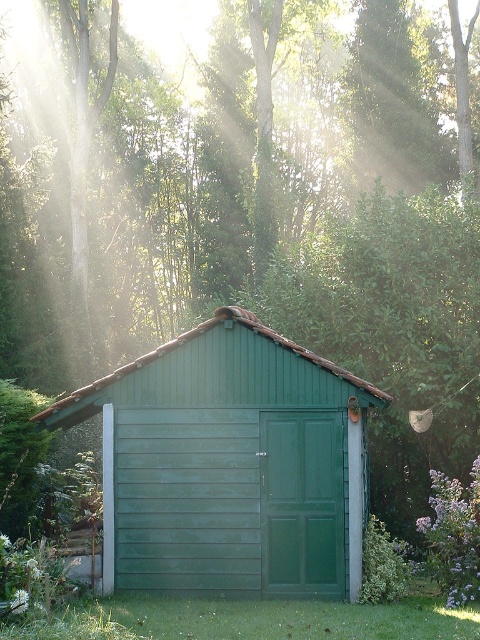
Question: Can you confirm if green wood/glass garage door at center is thinner than green wooden door at center?

Choices:
 (A) yes
 (B) no

Answer: (B)

Question: Which point is farther to the camera?

Choices:
 (A) green wood/glass garage door at center
 (B) green wooden door at center

Answer: (A)

Question: Is green wood/glass garage door at center positioned before green wooden door at center?

Choices:
 (A) no
 (B) yes

Answer: (A)

Question: Considering the relative positions of green woodshed at center and green wooden door at center in the image provided, where is green woodshed at center located with respect to green wooden door at center?

Choices:
 (A) right
 (B) left

Answer: (B)

Question: Among these objects, which one is farthest from the camera?

Choices:
 (A) green wooden door at center
 (B) green wood/glass garage door at center
 (C) green woodshed at center

Answer: (B)

Question: Which point is farther to the camera?

Choices:
 (A) green wooden door at center
 (B) green wood/glass garage door at center
 (C) green woodshed at center

Answer: (B)